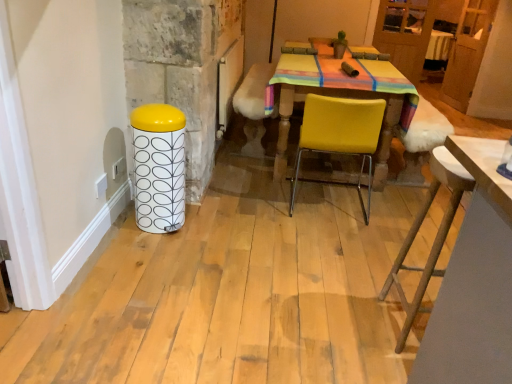
Question: Does velvet yellow armchair at center lie behind yellow matte chair at center?

Choices:
 (A) yes
 (B) no

Answer: (A)

Question: From the image's perspective, would you say velvet yellow armchair at center is positioned over yellow matte chair at center?

Choices:
 (A) no
 (B) yes

Answer: (B)

Question: Is velvet yellow armchair at center aimed at yellow matte chair at center?

Choices:
 (A) yes
 (B) no

Answer: (B)

Question: Can you confirm if velvet yellow armchair at center is positioned to the right of yellow matte chair at center?

Choices:
 (A) yes
 (B) no

Answer: (A)

Question: Considering the relative sizes of velvet yellow armchair at center and yellow matte chair at center in the image provided, is velvet yellow armchair at center smaller than yellow matte chair at center?

Choices:
 (A) yes
 (B) no

Answer: (A)

Question: Considering the positions of velvet yellow armchair at center and wooden table at lower right in the image, is velvet yellow armchair at center bigger or smaller than wooden table at lower right?

Choices:
 (A) big
 (B) small

Answer: (B)

Question: Is point (368, 51) closer or farther from the camera than point (437, 324)?

Choices:
 (A) farther
 (B) closer

Answer: (A)

Question: From a real-world perspective, relative to wooden table at lower right, is velvet yellow armchair at center vertically above or below?

Choices:
 (A) below
 (B) above

Answer: (B)

Question: In terms of height, does velvet yellow armchair at center look taller or shorter compared to wooden table at lower right?

Choices:
 (A) tall
 (B) short

Answer: (B)

Question: Is wooden table at lower right in front of or behind yellow matte chair at center in the image?

Choices:
 (A) behind
 (B) front

Answer: (B)

Question: Is point (496, 180) positioned closer to the camera than point (369, 160)?

Choices:
 (A) closer
 (B) farther

Answer: (A)

Question: Is wooden table at lower right wider or thinner than yellow matte chair at center?

Choices:
 (A) thin
 (B) wide

Answer: (A)

Question: From the image's perspective, is wooden table at lower right above or below yellow matte chair at center?

Choices:
 (A) above
 (B) below

Answer: (B)

Question: In terms of width, does yellow matte chair at center look wider or thinner when compared to white glossy trash can at left?

Choices:
 (A) thin
 (B) wide

Answer: (B)

Question: From the image's perspective, is yellow matte chair at center located above or below white glossy trash can at left?

Choices:
 (A) below
 (B) above

Answer: (B)